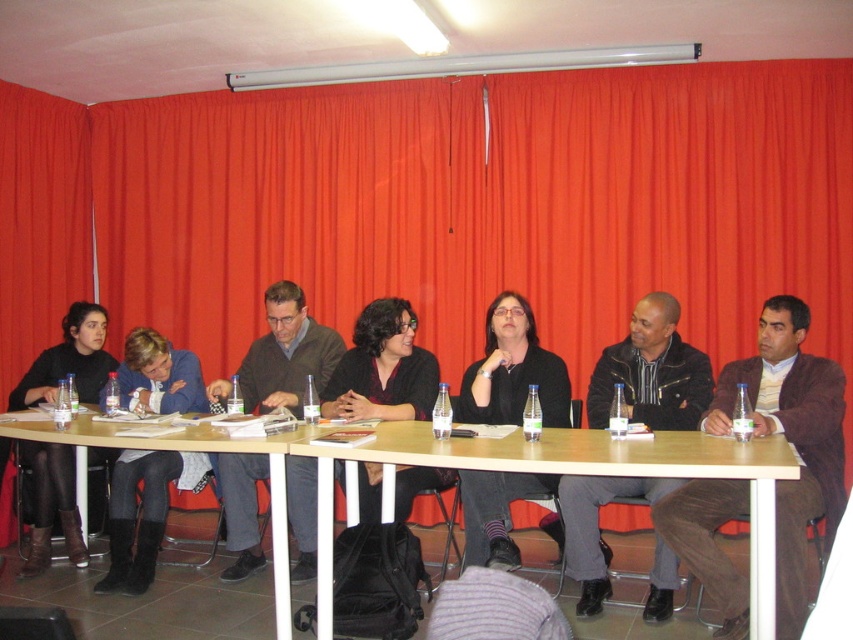
You are organizing a photoshoot and need to ensure that all participants are visible in the frame. Given that the matte brown sweater at center and the black matte shirt at center are both at the center of the table, which clothing item would require more space to fully capture in a photograph?

The matte brown sweater at center has a larger width than the black matte shirt at center, so it would require more space to fully capture in a photograph.

You are a photographer standing at the camera position. You want to take a closeup photo of the brown leather jacket at center. Can you reach it without moving your position?

The brown leather jacket at center is 2.84 meters away from camera, so yes, you can reach it without moving your position as it is within a typical camera focusing range.